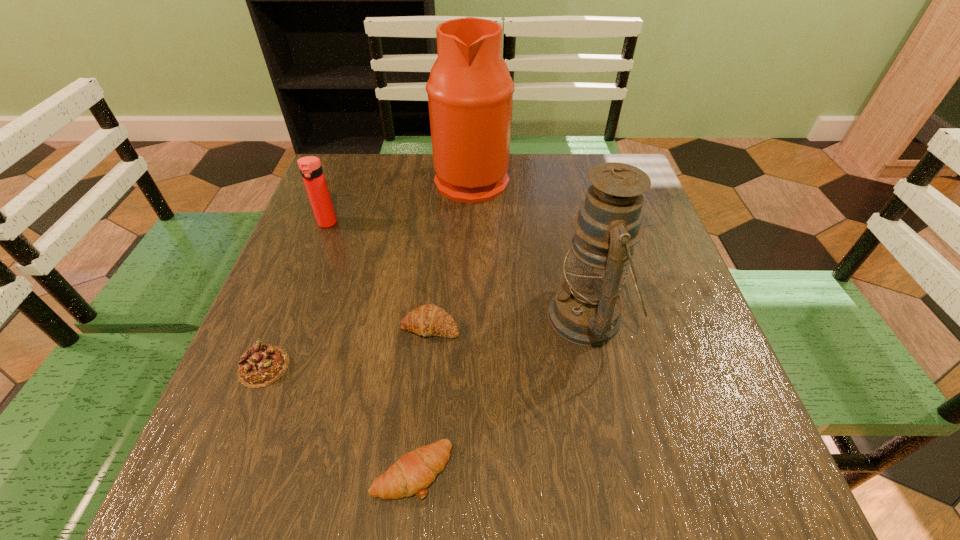
This screenshot has height=540, width=960. I want to click on free space located on the right of the second farthest object, so click(381, 224).

The width and height of the screenshot is (960, 540). What are the coordinates of `blank space located 0.240m on the front of the farther crescent roll` in the screenshot? It's located at (417, 471).

You are a GUI agent. You are given a task and a screenshot of the screen. Output one action in this format:
    pyautogui.click(x=<x>, y=<y>)
    Task: Click on the free location located 0.300m on the right of the chocolate cake
    This screenshot has height=540, width=960.
    Given the screenshot: What is the action you would take?
    pyautogui.click(x=454, y=367)

Find the location of a particular element. The image size is (960, 540). free location located 0.290m on the right of the nearer crescent roll is located at coordinates (642, 471).

The width and height of the screenshot is (960, 540). Identify the location of object at the far edge. (470, 91).

Where is `object situated at the near edge`? object situated at the near edge is located at coordinates (413, 472).

I want to click on thermos bottle that is positioned at the left edge, so click(x=310, y=167).

Find the location of `chocolate cake located at the left edge`. chocolate cake located at the left edge is located at coordinates (261, 365).

The image size is (960, 540). I want to click on object located in the right edge section of the desktop, so click(x=586, y=310).

You are a GUI agent. You are given a task and a screenshot of the screen. Output one action in this format:
    pyautogui.click(x=<x>, y=<y>)
    Task: Click on the free spot at the near edge of the desktop
    
    Given the screenshot: What is the action you would take?
    pyautogui.click(x=352, y=490)